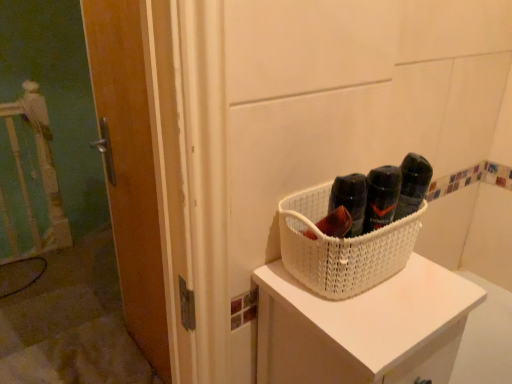
Question: In the image, is white woven basket at upper right positioned in front of or behind wooden door at left?

Choices:
 (A) front
 (B) behind

Answer: (A)

Question: Based on their sizes in the image, would you say white woven basket at upper right is bigger or smaller than wooden door at left?

Choices:
 (A) big
 (B) small

Answer: (A)

Question: Based on their relative distances, which object is nearer to the white woven basket at center?

Choices:
 (A) white woven basket at upper right
 (B) wooden door at left

Answer: (A)

Question: Estimate the real-world distances between objects in this image. Which object is closer to the white woven basket at upper right?

Choices:
 (A) wooden door at left
 (B) white woven basket at center

Answer: (B)